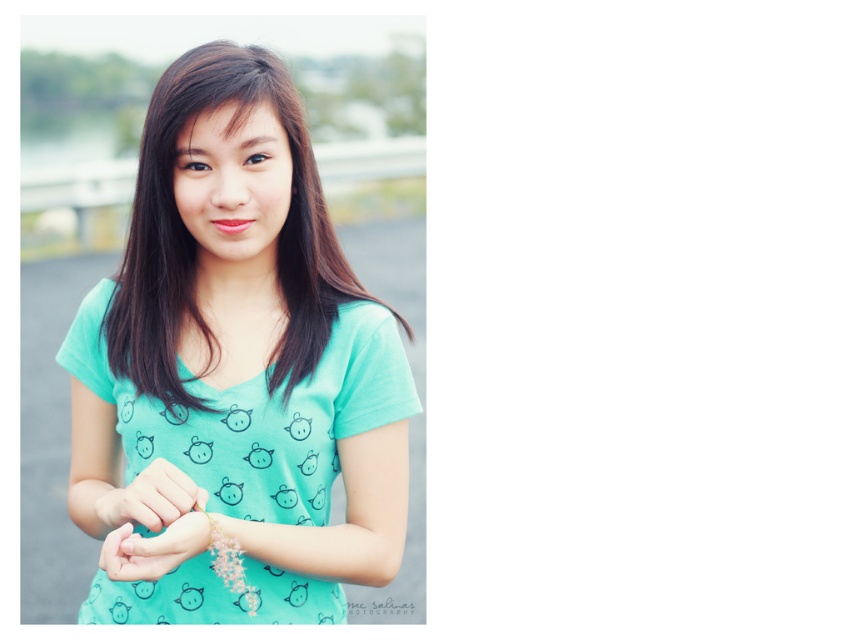
From the picture: You are a fashion designer analyzing the image of a person wearing two shirts. The mint green fabric shirt at center and the matte teal shirt at center. Which shirt is taller?

The mint green fabric shirt at center is taller than the matte teal shirt at center.

You are a photographer who wants to focus on the mint green fabric shirt at center. The camera is currently focused on point (242, 356). Is the camera focused on the correct spot?

Yes, the point (242, 356) is on the mint green fabric shirt at center, so the camera is focused on the correct spot.

You are a photographer adjusting your camera settings to focus on the matte gold bracelet at center and the matte teal shirt at center. Based on their positions, which object should you focus on first if you want to ensure both are in focus without moving the camera?

The matte gold bracelet at center is to the left of matte teal shirt at center, so you should focus on the matte teal shirt at center first since it is closer to the camera. This will ensure the bracelet, being slightly further left, remains in focus as well.